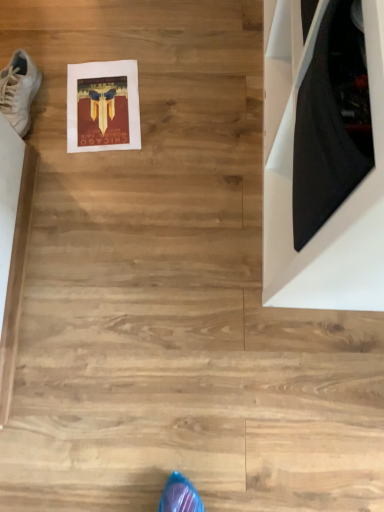
At what (x,y) coordinates should I click in order to perform the action: click on free space in front of black matte cardboard at right. Please return your answer as a coordinate pair (x, y). The image size is (384, 512). Looking at the image, I should click on (241, 384).